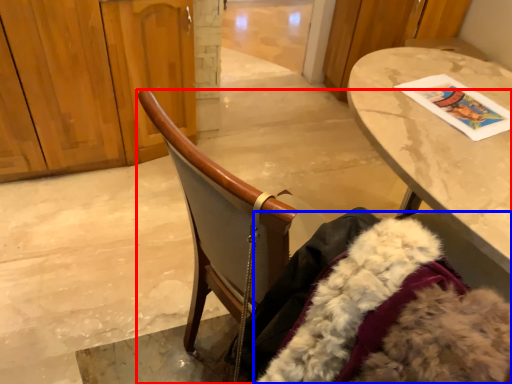
Question: Which object appears farthest to the camera in this image, chair (highlighted by a red box) or fur coat (highlighted by a blue box)?

Choices:
 (A) chair
 (B) fur coat

Answer: (B)